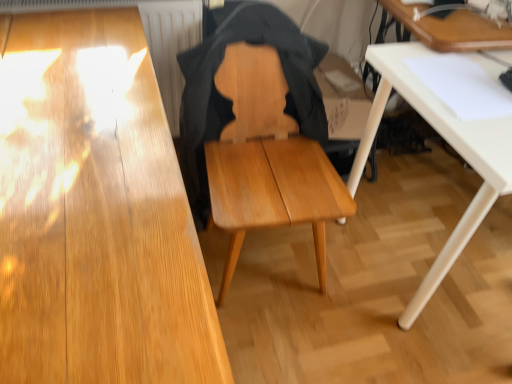
Question: Based on their sizes in the image, would you say wooden table at upper right, which is the first table from top to bottom, is bigger or smaller than white matte table at lower right, positioned as the 2th table in top-to-bottom order?

Choices:
 (A) small
 (B) big

Answer: (A)

Question: From their relative heights in the image, would you say wooden table at upper right, which is the first table from top to bottom, is taller or shorter than white matte table at lower right, positioned as the 2th table in top-to-bottom order?

Choices:
 (A) short
 (B) tall

Answer: (A)

Question: Estimate the real-world distances between objects in this image. Which object is farther from the white matte table at lower right, positioned as the 2th table in top-to-bottom order?

Choices:
 (A) light brown wood chair at center
 (B) wooden table at upper right, which is the first table from top to bottom

Answer: (A)

Question: Estimate the real-world distances between objects in this image. Which object is closer to the light brown wood chair at center?

Choices:
 (A) wooden table at upper right, marked as the 2th table in a bottom-to-top arrangement
 (B) white matte table at lower right, positioned as the 2th table in top-to-bottom order

Answer: (B)